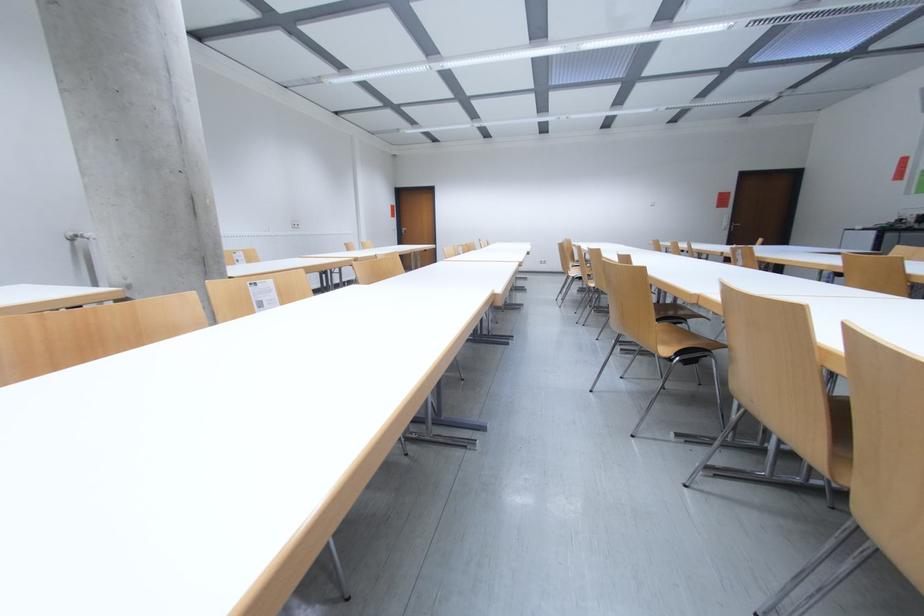
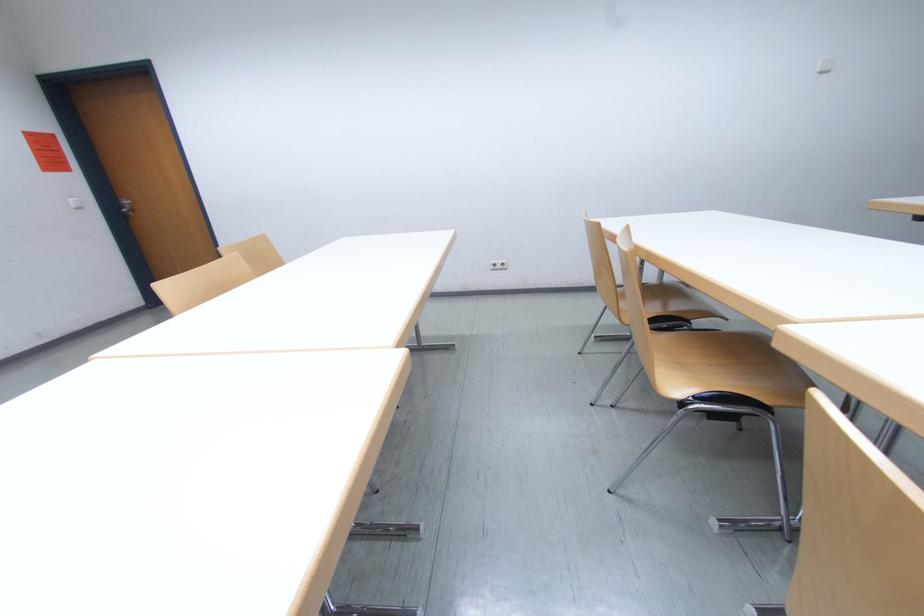
In the second image, find the point that corresponds to (x=551, y=262) in the first image.

(505, 265)